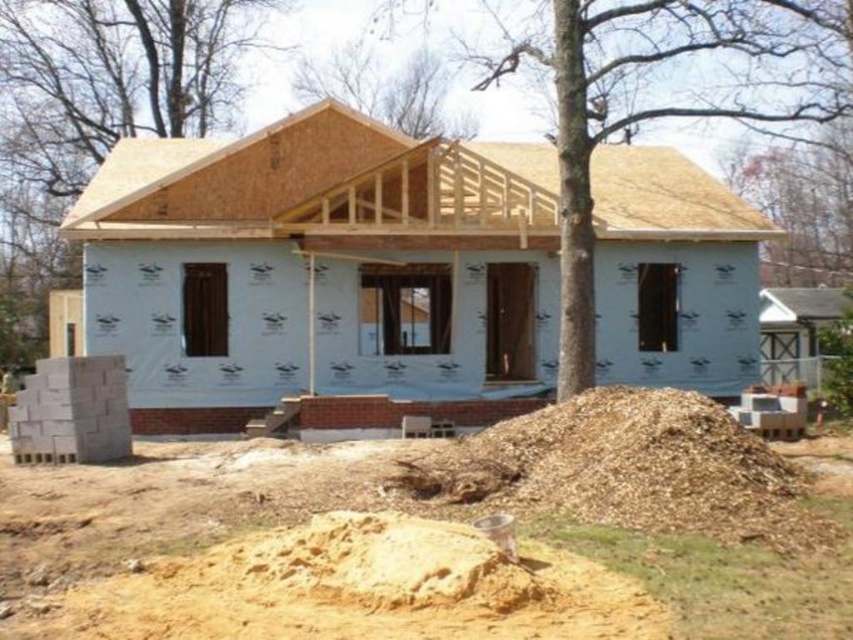
Who is lower down, light brown wood at upper center or brown mulch at lower center?

brown mulch at lower center is below.

Is light brown wood at upper center shorter than brown mulch at lower center?

No, light brown wood at upper center is not shorter than brown mulch at lower center.

Who is more forward, (268,193) or (737,504)?

→ Point (737,504) is in front.

Locate an element on the screen. This screenshot has height=640, width=853. light brown wood at upper center is located at coordinates (317, 182).